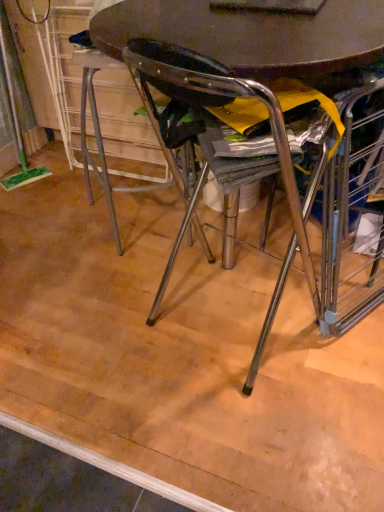
The width and height of the screenshot is (384, 512). I want to click on vacant area that lies in front of metallic brown table at center, so click(x=238, y=444).